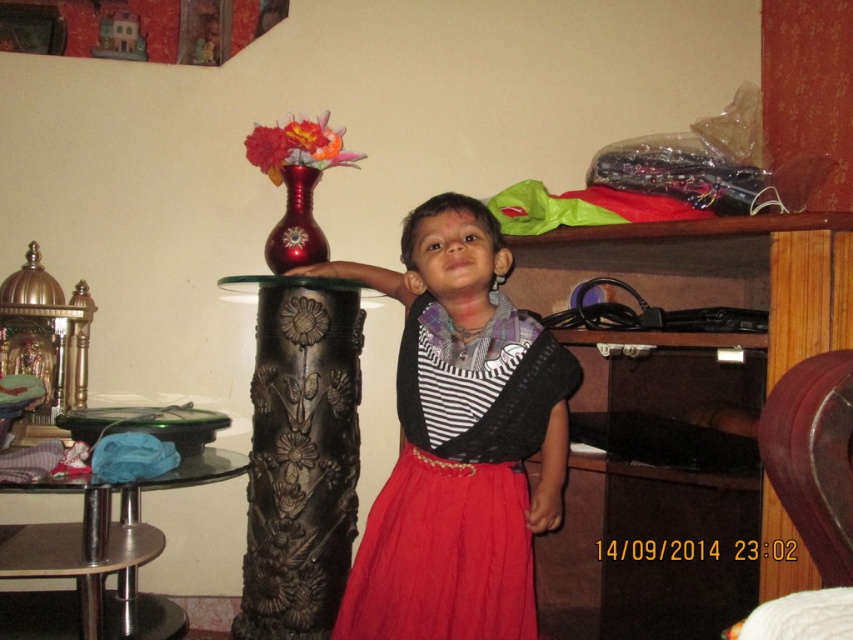
You are a delivery person who needs to place a package on the shiny red vase at center. The package is 2 meters in length. Can you safely place the package on the vase without it falling off?

The shiny red vase at center and camera are 2.17 meters apart from each other. Since the package is 2 meters long, it can be placed on the vase as the distance between the vase and the camera is sufficient to accommodate the package without it falling off.

You are a delivery person who needs to place a package on the green glass tray at lower left. However, there is a shiny red vase at center in the way. Can you place the package directly on the tray without moving the vase?

The green glass tray at lower left is positioned under the shiny red vase at center, so the vase is blocking access to the tray. You cannot place the package directly on the tray without moving the vase.